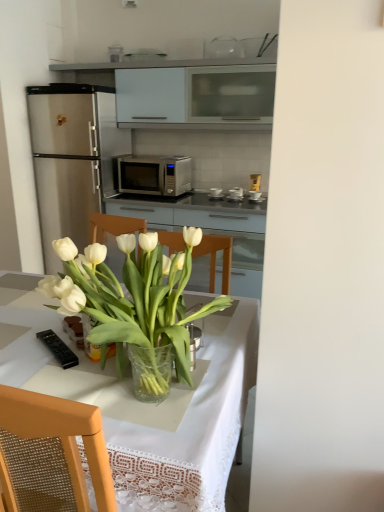
Where is `unoccupied space behind black plastic remote control at lower left, the first appliance viewed from the left`? The width and height of the screenshot is (384, 512). unoccupied space behind black plastic remote control at lower left, the first appliance viewed from the left is located at coordinates (51, 324).